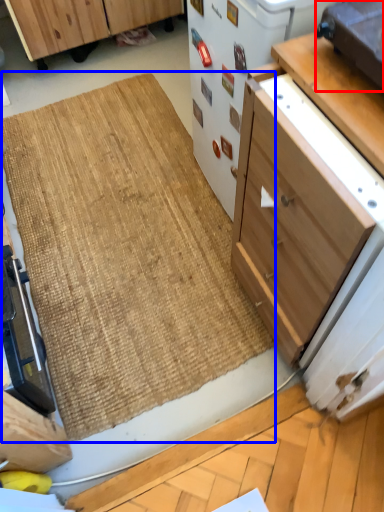
Question: Which of the following is the closest to the observer, appliance (highlighted by a red box) or doormat (highlighted by a blue box)?

Choices:
 (A) appliance
 (B) doormat

Answer: (A)